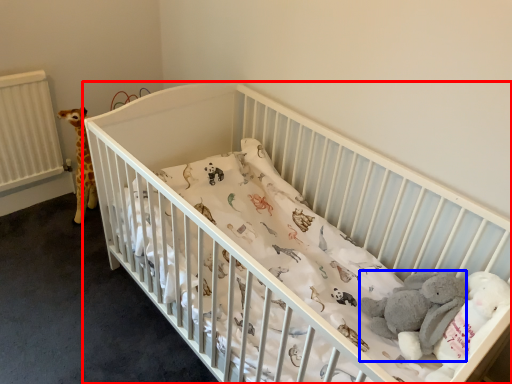
Question: Which point is closer to the camera, infant bed (highlighted by a red box) or baby elephant (highlighted by a blue box)?

Choices:
 (A) infant bed
 (B) baby elephant

Answer: (A)